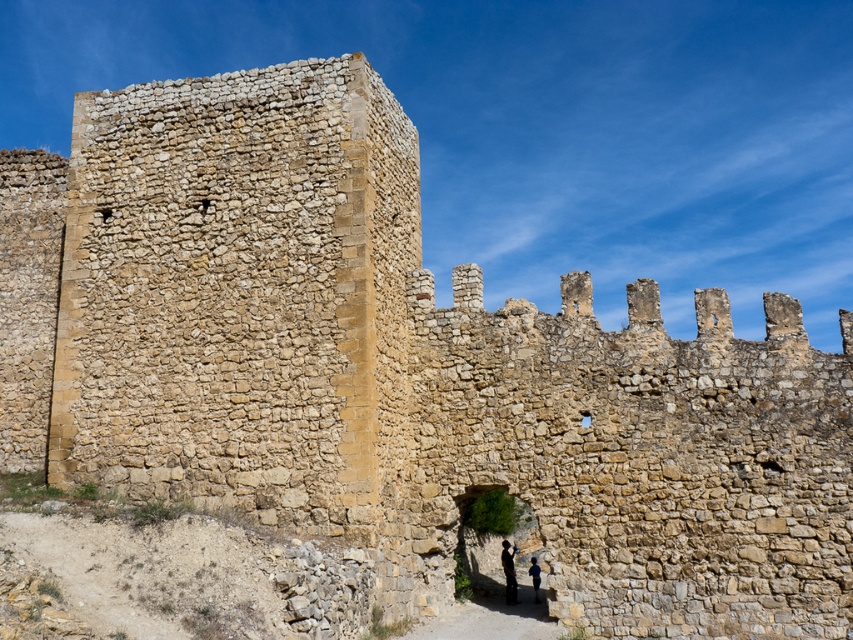
Question: Does dark blue fabric at center lie in front of blue fabric at lower center?

Choices:
 (A) no
 (B) yes

Answer: (A)

Question: Among these objects, which one is nearest to the camera?

Choices:
 (A) dark blue fabric at center
 (B) blue fabric at lower center

Answer: (B)

Question: Observing the image, what is the correct spatial positioning of dark blue fabric at center in reference to blue fabric at lower center?

Choices:
 (A) left
 (B) right

Answer: (A)

Question: Is dark blue fabric at center positioned before blue fabric at lower center?

Choices:
 (A) no
 (B) yes

Answer: (A)